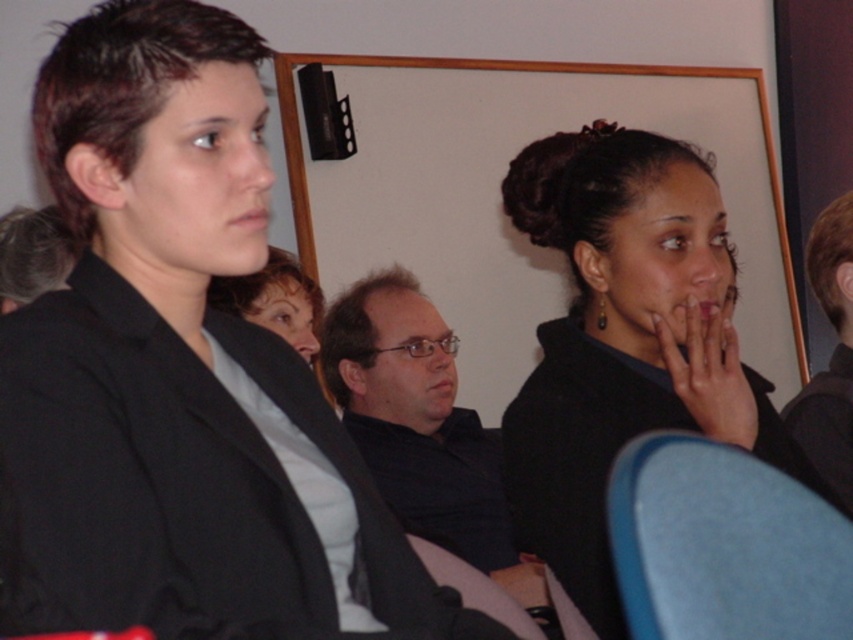
You are organizing a meeting and need to seat two attendees. You have a blue fabric chair at lower right and a dark blue shirt at center. Which seating option is more suitable for a taller attendee?

The dark blue shirt at center is more suitable for a taller attendee because the blue fabric chair at lower right has a smaller size compared to dark blue shirt at center.

You are standing at the center of the image and want to move to the blue fabric chair at lower right. In which direction should you move relative to your current position?

Since the blue fabric chair at lower right is located at coordinates approximately 0.853 on the x and y axis, you should move towards the lower right direction to reach it.